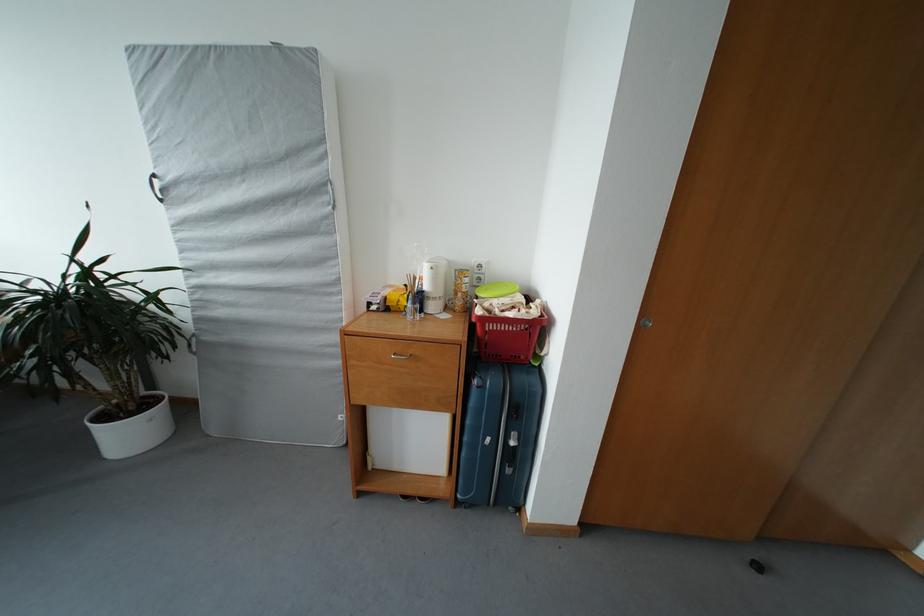
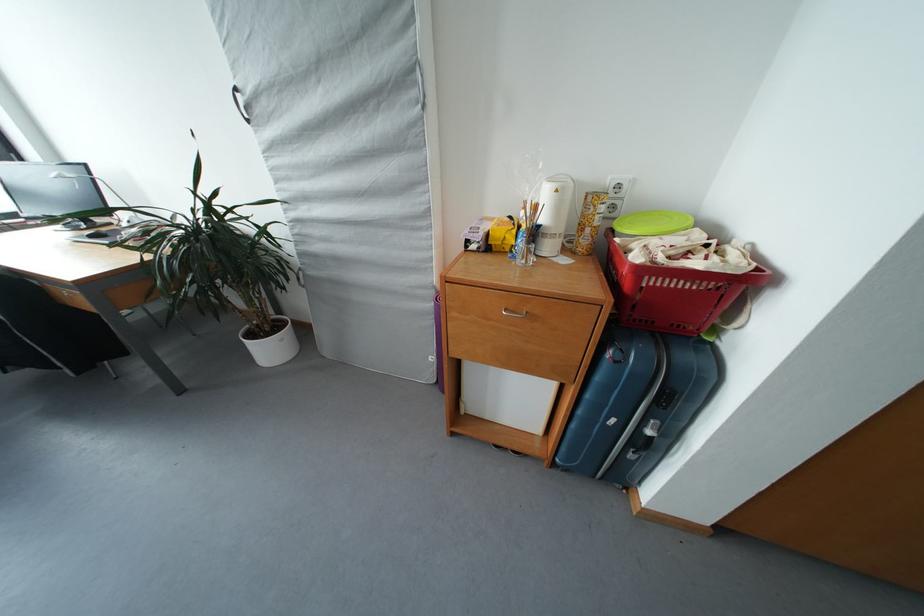
Locate, in the second image, the point that corresponds to point 483,299 in the first image.

(625, 233)